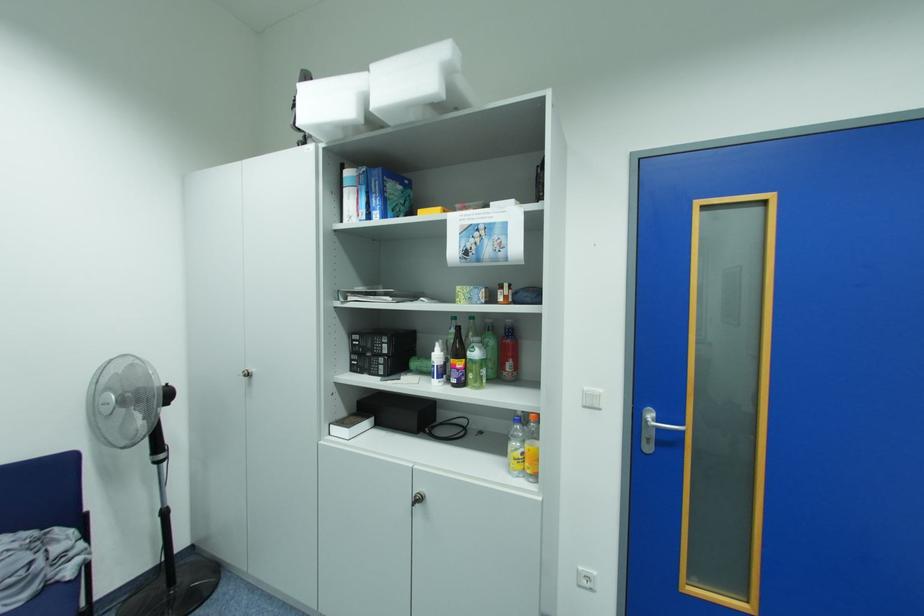
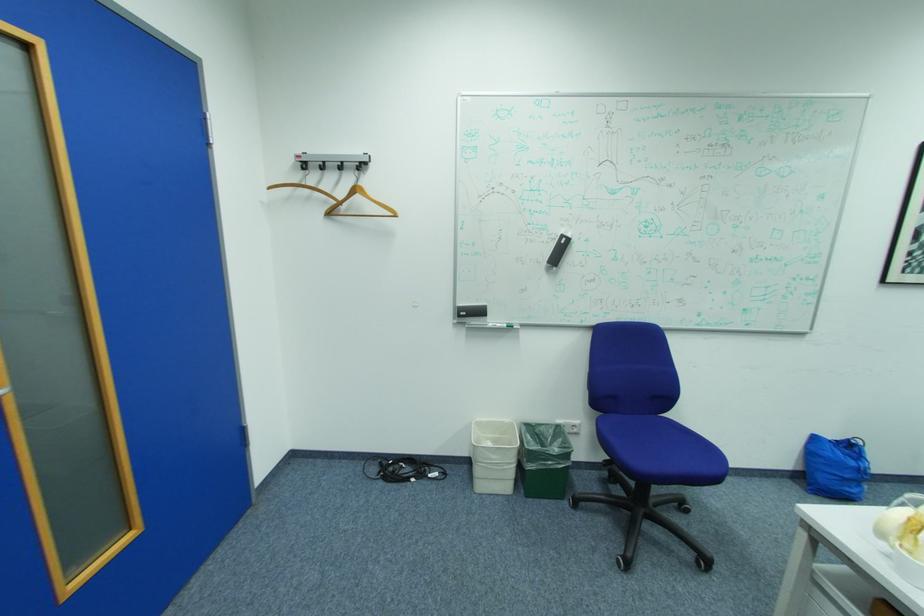
Question: Based on the continuous images, in which direction is the camera rotating? Reply with the corresponding letter.

Choices:
 (A) Left
 (B) Right
 (C) Up
 (D) Down

Answer: (B)